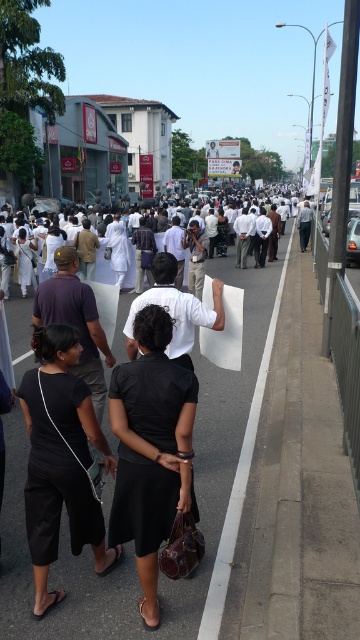
Question: From the image, what is the correct spatial relationship of asphalt pavement at center in relation to matte black dress at center?

Choices:
 (A) below
 (B) above

Answer: (A)

Question: Which point is closer to the camera?

Choices:
 (A) (106, 588)
 (B) (159, 244)
 (C) (177, 456)

Answer: (C)

Question: Does white cloth crowd at center have a larger size compared to matte black dress at center?

Choices:
 (A) yes
 (B) no

Answer: (A)

Question: Which of the following is the farthest from the observer?

Choices:
 (A) black matte pants at lower left
 (B) asphalt pavement at center
 (C) matte black dress at center

Answer: (C)

Question: In this image, where is black fabric dress at center located relative to black matte pants at lower left?

Choices:
 (A) left
 (B) right

Answer: (B)

Question: Which of these objects is positioned closest to the black fabric dress at center?

Choices:
 (A) white cloth crowd at center
 (B) asphalt pavement at center
 (C) matte black dress at center
 (D) black matte pants at lower left

Answer: (D)